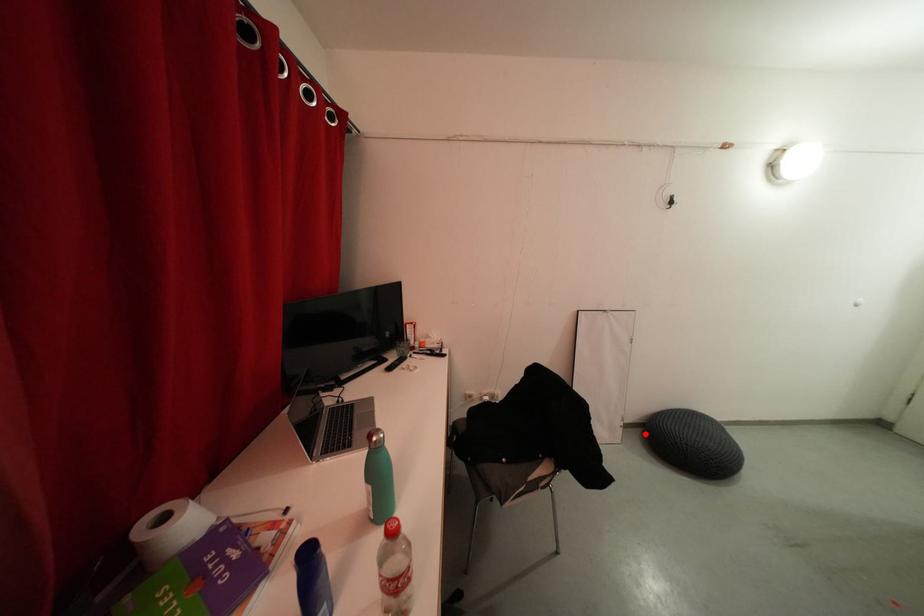
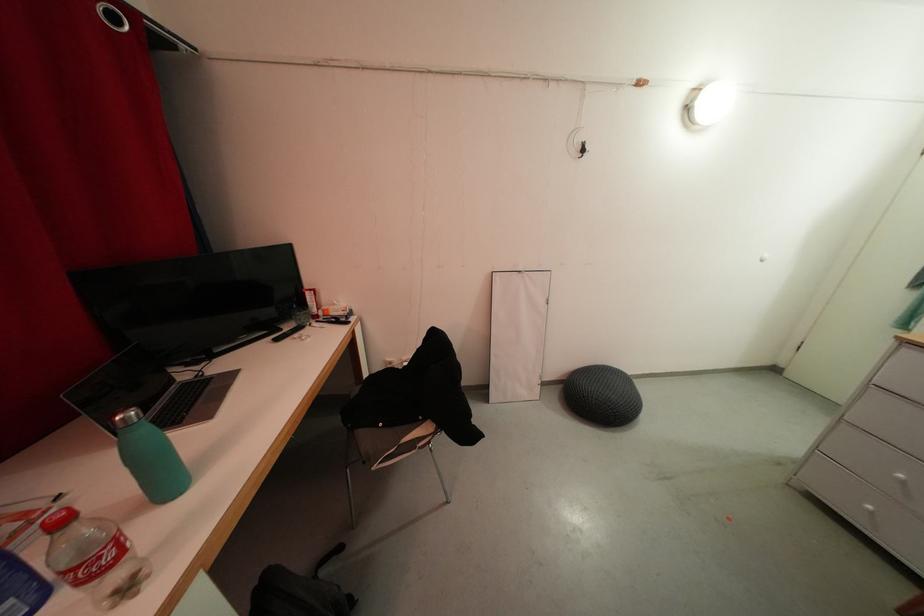
The point at the highlighted location is marked in the first image. Where is the corresponding point in the second image?

(565, 390)